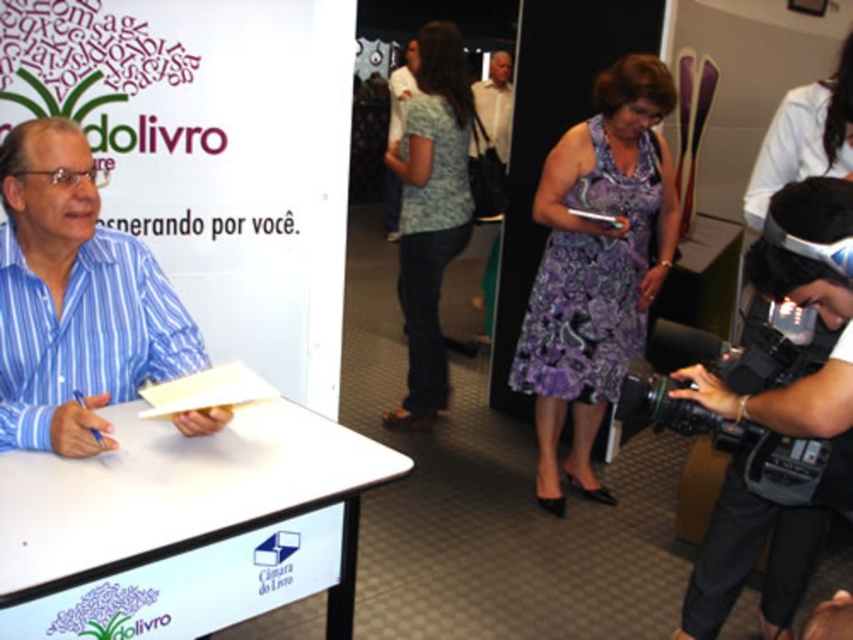
Question: Which of the following is the closest to the observer?

Choices:
 (A) black plastic video camera at lower right
 (B) purple printed dress at center
 (C) black matte camera at lower right
 (D) blue striped shirt at left

Answer: (D)

Question: Which point is closer to the camera taking this photo?

Choices:
 (A) (201, 509)
 (B) (544, 387)

Answer: (A)

Question: Is purple printed dress at center above denim jeans at center?

Choices:
 (A) yes
 (B) no

Answer: (B)

Question: Which object is positioned closest to the denim jeans at center?

Choices:
 (A) purple floral dress at center
 (B) black plastic video camera at lower right
 (C) white plastic table at center

Answer: (A)

Question: Is purple printed dress at center positioned at the back of black plastic video camera at lower right?

Choices:
 (A) no
 (B) yes

Answer: (B)

Question: Considering the relative positions of white plastic table at center and blue striped shirt at left in the image provided, where is white plastic table at center located with respect to blue striped shirt at left?

Choices:
 (A) below
 (B) above

Answer: (A)